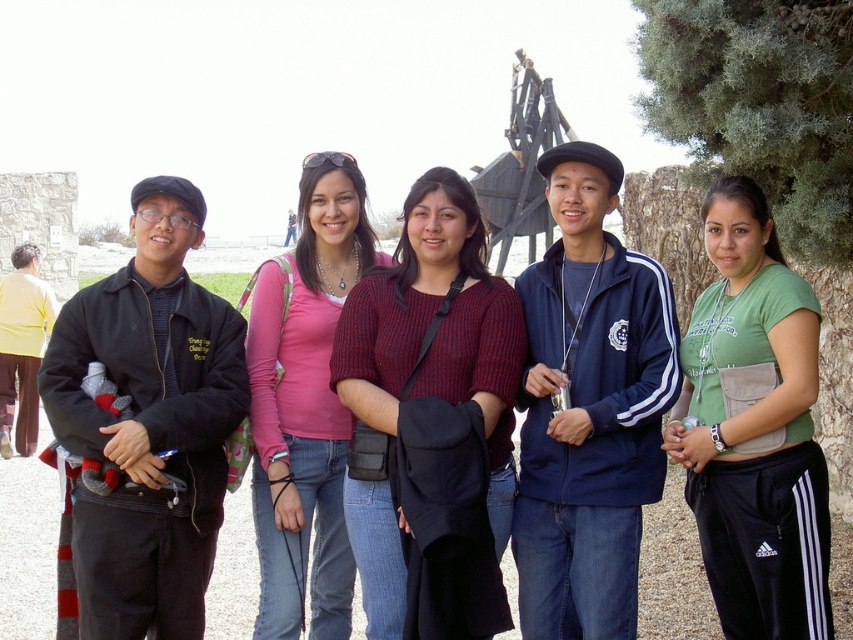
Question: Considering the relative positions of blue track jacket at center and pink fabric shirt at center in the image provided, where is blue track jacket at center located with respect to pink fabric shirt at center?

Choices:
 (A) left
 (B) right

Answer: (B)

Question: Which object appears closest to the camera in this image?

Choices:
 (A) knitted maroon sweater at center
 (B) blue track jacket at center
 (C) green fabric shirt at center

Answer: (C)

Question: Does knitted maroon sweater at center appear under black matte jacket at left?

Choices:
 (A) yes
 (B) no

Answer: (B)

Question: Among these points, which one is nearest to the camera?

Choices:
 (A) (265, 522)
 (B) (801, 301)
 (C) (210, 298)

Answer: (B)

Question: Which of the following is the closest to the observer?

Choices:
 (A) (769, 276)
 (B) (410, 260)
 (C) (86, 529)
 (D) (268, 470)

Answer: (C)

Question: Is knitted maroon sweater at center further to the viewer compared to blue track jacket at center?

Choices:
 (A) yes
 (B) no

Answer: (B)